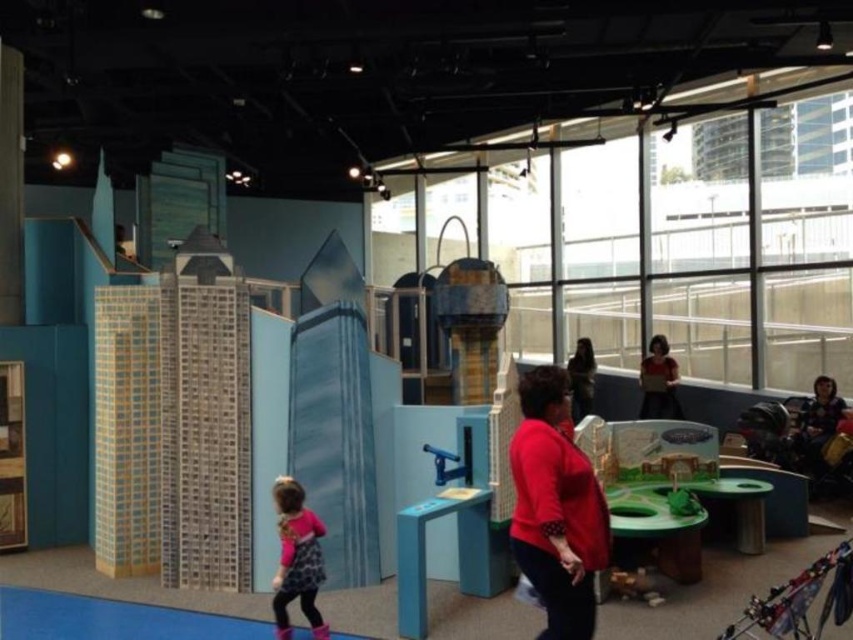
You are standing in the play area and want to locate the dark brown hair at center. Where exactly is it positioned in the image?

The dark brown hair at center is positioned at point coordinates of 0.591 on the x axis and 0.682 on the y axis.

You are a visitor in the play area and want to take a photo of both the point at coordinates (653,380) and the point at coordinates (587,356). Which point should you focus on first to ensure both are in clear view?

You should focus on point (653,380) first because it is closer to the camera than point (587,356), ensuring both points are in clear view.